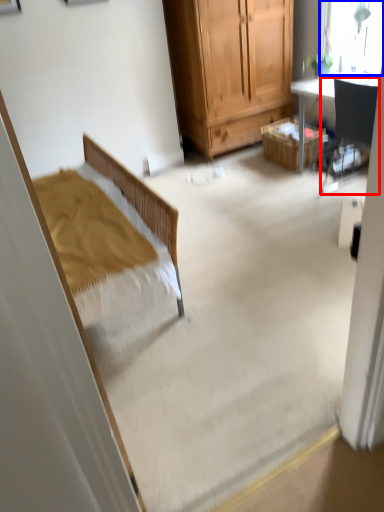
Question: Which point is closer to the camera, chair (highlighted by a red box) or window (highlighted by a blue box)?

Choices:
 (A) chair
 (B) window

Answer: (A)